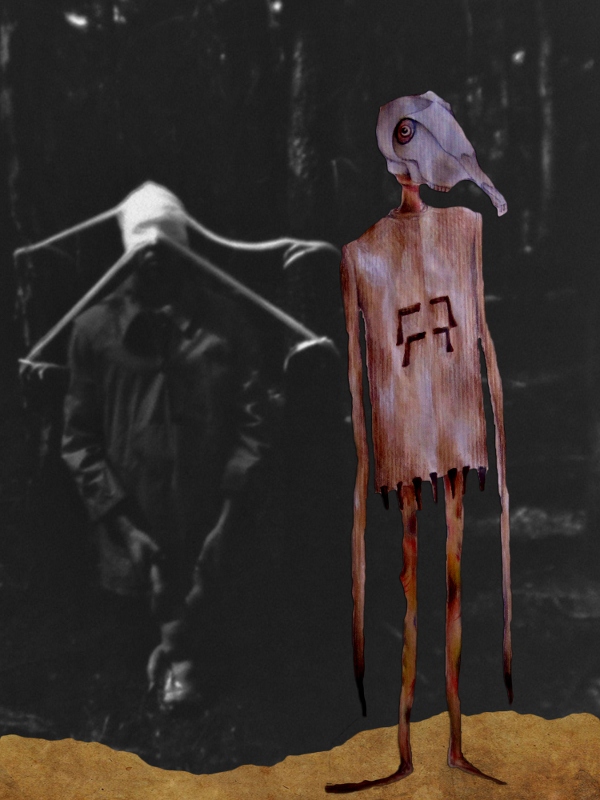
The image size is (600, 800). I want to click on coat, so click(x=123, y=362).